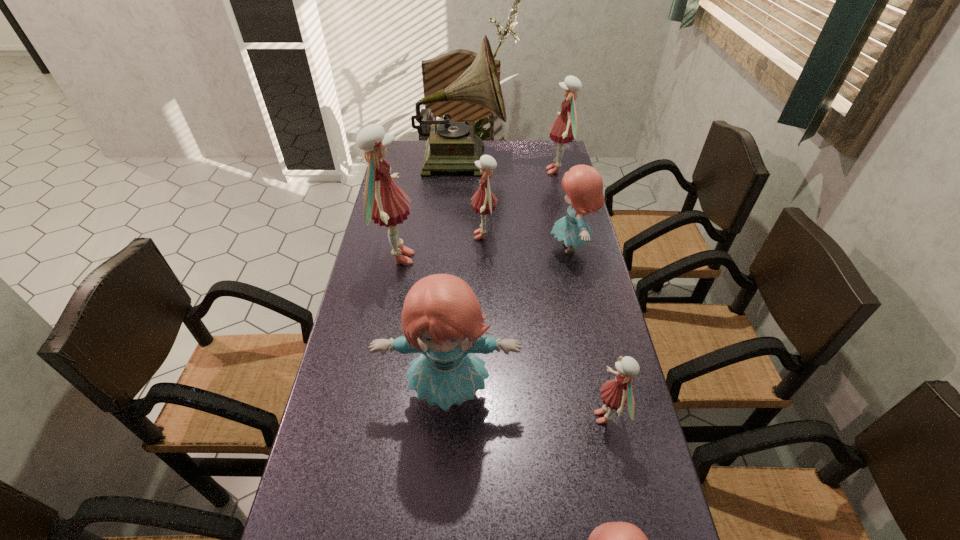
What are the coordinates of `record player` in the screenshot? It's located at (453, 146).

What are the coordinates of `the tallest doll` in the screenshot? It's located at (384, 203).

Find the location of a particular element. The height and width of the screenshot is (540, 960). the biggest pink doll is located at coordinates (384, 203).

Find the location of `the farthest pink doll`. the farthest pink doll is located at coordinates (564, 130).

Find the location of `the farthest doll`. the farthest doll is located at coordinates (564, 130).

Identify the location of the biggest blue doll. (441, 318).

I want to click on the leftmost blue doll, so click(x=441, y=318).

Locate an element on the screen. the second pink doll from left to right is located at coordinates (485, 202).

The width and height of the screenshot is (960, 540). Identify the location of the farthest blue doll. (583, 184).

This screenshot has width=960, height=540. Find the location of `the smallest pink doll`. the smallest pink doll is located at coordinates (615, 393).